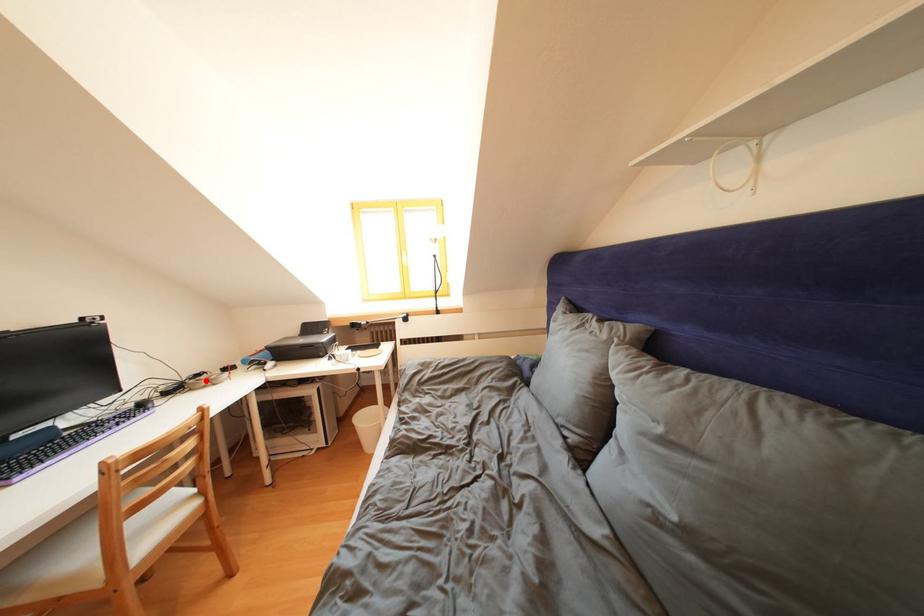
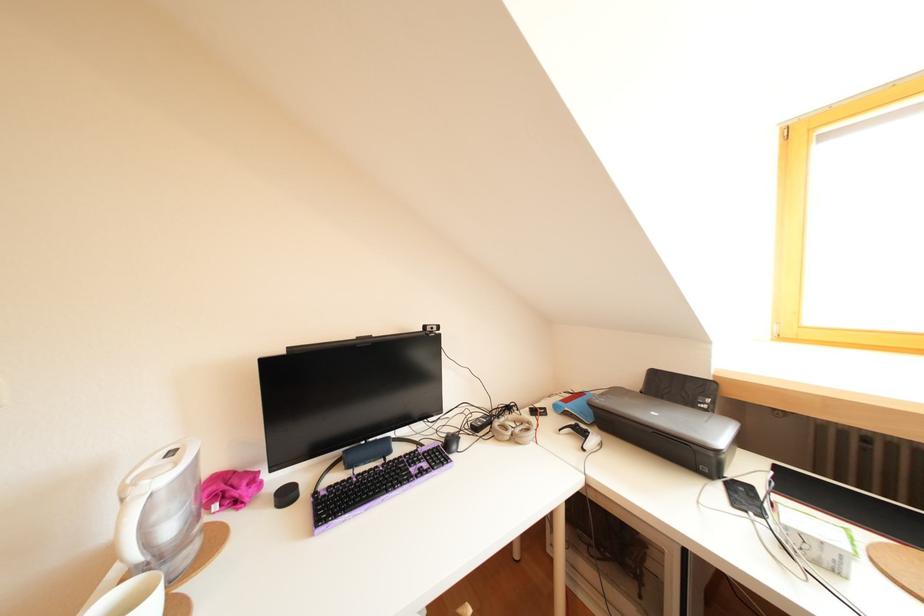
Locate, in the second image, the point that corresponds to the highlighted location in the first image.

(516, 413)